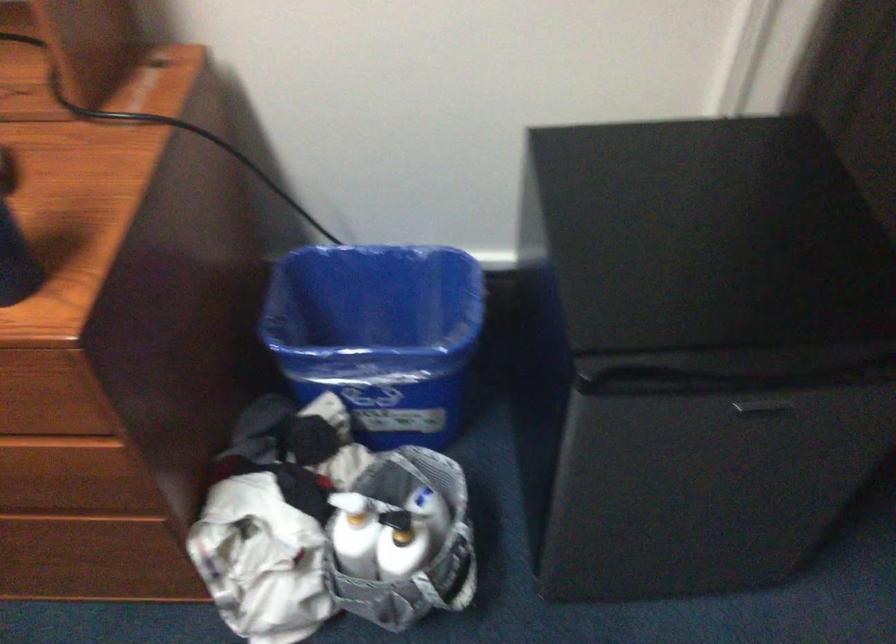
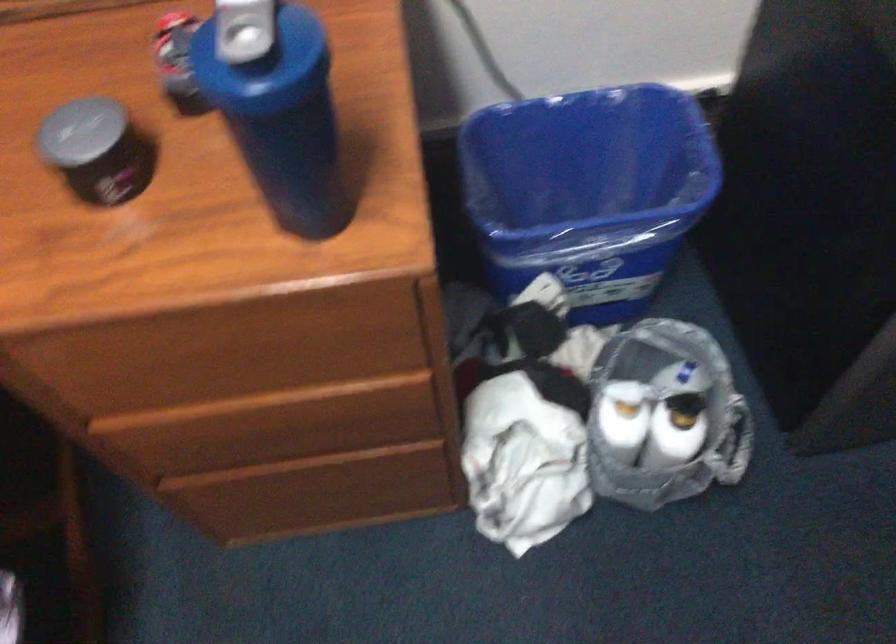
Locate, in the second image, the point that corresponds to point (410, 333) in the first image.

(588, 192)